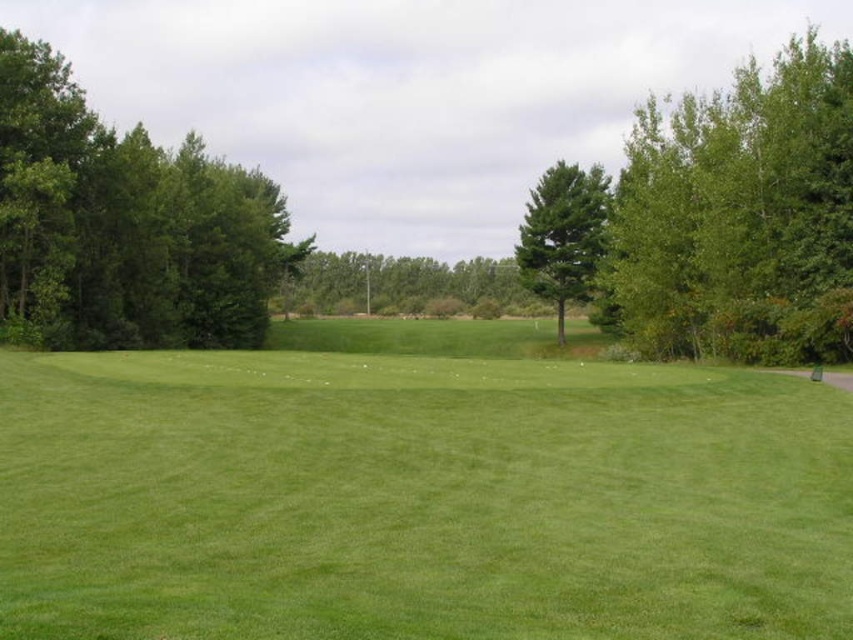
You are standing at the point marked as point [418,492] on the image. What is the name of the area you are currently standing on?

The point [418,492] corresponds to the green grassy field at center, so you are standing on the green grassy field at center.

You are a golfer standing on the green grassy field at center. You want to hit a ball to the green leafy tree at left. Considering the height difference between the two, will the ball need to be hit upwards or downwards?

The green grassy field at center is shorter than the green leafy tree at left, so you will need to hit the ball upwards to reach the tree.

You are a golfer standing on the green grassy field at center and want to hit a ball towards the green leafy tree at left. Considering their positions, will the tree block your view of the field behind it?

The green grassy field at center is in front of the green leafy tree at left, so the tree will block your view of the field behind it when you hit the ball towards it.